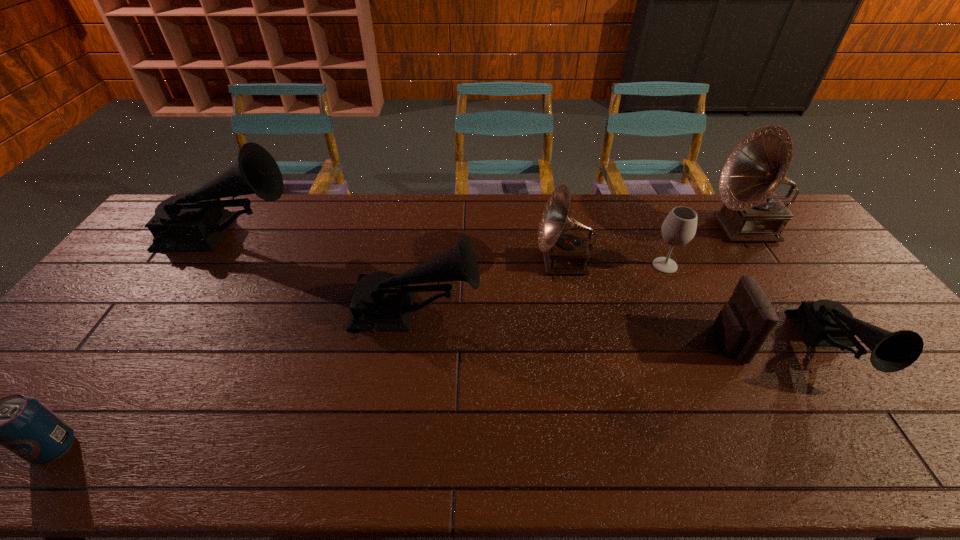
Locate an element on the screen. This screenshot has width=960, height=540. pouch is located at coordinates (744, 323).

Find the location of a particular element. pop soda is located at coordinates (23, 425).

This screenshot has height=540, width=960. I want to click on the shortest object, so click(x=23, y=425).

Where is `vacant space situated 0.080m on the horn of the right brown phonograph record`? The width and height of the screenshot is (960, 540). vacant space situated 0.080m on the horn of the right brown phonograph record is located at coordinates (687, 229).

Where is `vacant region located on the horn of the right brown phonograph record`? vacant region located on the horn of the right brown phonograph record is located at coordinates pos(640,229).

Where is `vacant space located 0.300m on the horn of the right brown phonograph record`? vacant space located 0.300m on the horn of the right brown phonograph record is located at coordinates (623, 229).

Find the location of a particular element. The image size is (960, 540). free space located from the horn of the leftmost phonograph_record is located at coordinates (330, 235).

Find the location of `free space located 0.160m on the horn of the left brown phonograph record`. free space located 0.160m on the horn of the left brown phonograph record is located at coordinates (485, 263).

Where is `vacant space located on the horn of the left brown phonograph record`? Image resolution: width=960 pixels, height=540 pixels. vacant space located on the horn of the left brown phonograph record is located at coordinates (427, 263).

At what (x,y) coordinates should I click in order to perform the action: click on vacant space positioned 0.050m on the horn of the left brown phonograph record. Please return your answer as a coordinate pair (x, y). The height and width of the screenshot is (540, 960). Looking at the image, I should click on (520, 263).